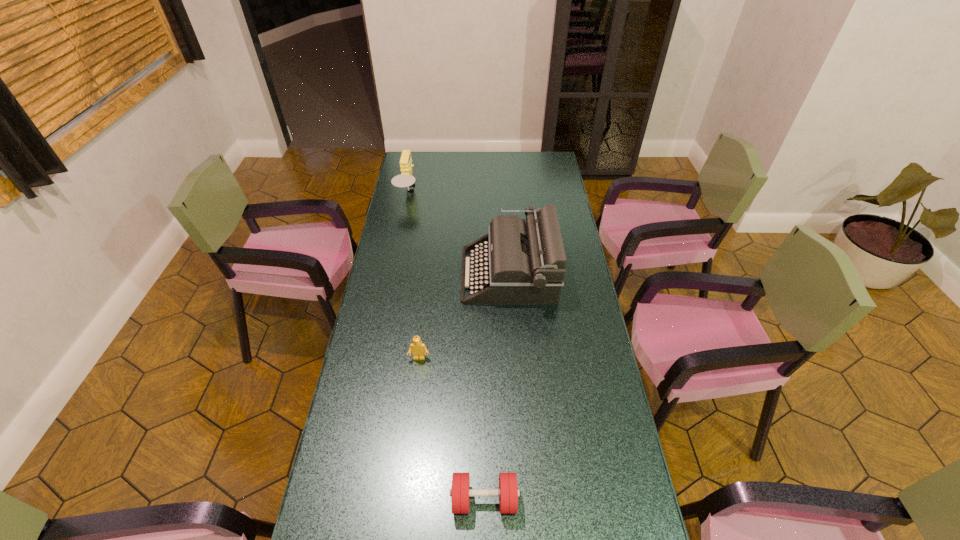
Where is `vacant point located between the dumbbell and the second object from left to right`? Image resolution: width=960 pixels, height=540 pixels. vacant point located between the dumbbell and the second object from left to right is located at coordinates (452, 429).

Find the location of a particular element. vacant area between the typewriter and the third object from right to left is located at coordinates (464, 316).

At what (x,y) coordinates should I click in order to perform the action: click on empty space between the second farthest object and the third farthest object. Please return your answer as a coordinate pair (x, y). Looking at the image, I should click on (464, 316).

At what (x,y) coordinates should I click in order to perform the action: click on vacant area that lies between the sponge and the Lego. Please return your answer as a coordinate pair (x, y). The width and height of the screenshot is (960, 540). Looking at the image, I should click on (414, 275).

You are a GUI agent. You are given a task and a screenshot of the screen. Output one action in this format:
    pyautogui.click(x=<x>, y=<y>)
    Task: Click on the vacant area that lies between the farthest object and the third object from right to left
    
    Given the screenshot: What is the action you would take?
    pyautogui.click(x=414, y=275)

At what (x,y) coordinates should I click in order to perform the action: click on vacant point located between the third shortest object and the typewriter. Please return your answer as a coordinate pair (x, y). Looking at the image, I should click on (459, 234).

The height and width of the screenshot is (540, 960). In order to click on vacant space in between the nearest object and the tallest object in this screenshot , I will do `click(496, 387)`.

Where is `free point between the second nearest object and the second farthest object`? The width and height of the screenshot is (960, 540). free point between the second nearest object and the second farthest object is located at coordinates (464, 316).

At what (x,y) coordinates should I click in order to perform the action: click on the third closest object to the sponge. Please return your answer as a coordinate pair (x, y). Looking at the image, I should click on (460, 492).

Find the location of a particular element. object that ranks as the closest to the nearest object is located at coordinates (417, 347).